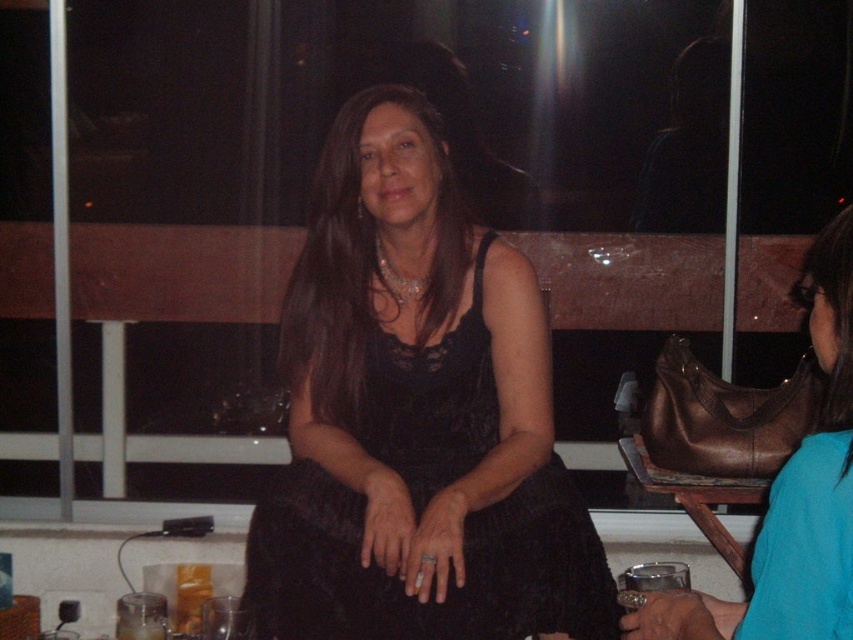
Does black lace dress at center have a greater width compared to clear glass wine glass at lower center?

Indeed, black lace dress at center has a greater width compared to clear glass wine glass at lower center.

Is black lace dress at center further to camera compared to clear glass wine glass at lower center?

No.

Between point (379, 458) and point (236, 612), which one is positioned in front?

Positioned in front is point (379, 458).

What are the coordinates of `black lace dress at center` in the screenshot? It's located at (433, 577).

Can you confirm if metallic brown purse at right is positioned above transparent glass at lower right?

Yes.

Who is taller, metallic brown purse at right or transparent glass at lower right?

metallic brown purse at right

Describe the element at coordinates (793, 497) in the screenshot. I see `metallic brown purse at right` at that location.

Where is `metallic brown purse at right`? The height and width of the screenshot is (640, 853). metallic brown purse at right is located at coordinates (793, 497).

Is black lace dress at center positioned behind transparent glass at lower right?

No, it is not.

Does black lace dress at center have a larger size compared to transparent glass at lower right?

Yes, black lace dress at center is bigger than transparent glass at lower right.

What do you see at coordinates (433, 577) in the screenshot? The height and width of the screenshot is (640, 853). I see `black lace dress at center` at bounding box center [433, 577].

Locate an element on the screen. The image size is (853, 640). black lace dress at center is located at coordinates (433, 577).